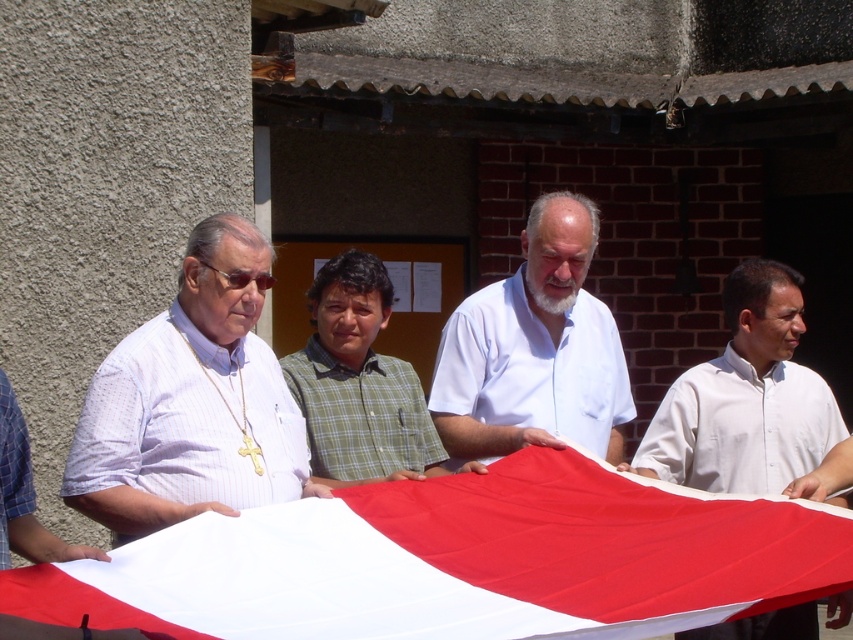
Between white matte shirt at center and white smooth shirt at center, which one has more height?

Standing taller between the two is white matte shirt at center.

Does white matte shirt at center have a greater height compared to white smooth shirt at center?

Correct, white matte shirt at center is much taller as white smooth shirt at center.

The image size is (853, 640). What do you see at coordinates (534, 349) in the screenshot?
I see `white matte shirt at center` at bounding box center [534, 349].

Find the location of `white matte shirt at center`. white matte shirt at center is located at coordinates (534, 349).

Does white fabric flag at center have a lesser width compared to white striped shirt at left?

No, white fabric flag at center is not thinner than white striped shirt at left.

The height and width of the screenshot is (640, 853). What do you see at coordinates (461, 561) in the screenshot? I see `white fabric flag at center` at bounding box center [461, 561].

You are a GUI agent. You are given a task and a screenshot of the screen. Output one action in this format:
    pyautogui.click(x=<x>, y=<y>)
    Task: Click on the white fabric flag at center
    
    Given the screenshot: What is the action you would take?
    pyautogui.click(x=461, y=561)

Who is taller, white fabric flag at center or green checkered shirt at center?

With more height is green checkered shirt at center.

Which is behind, point (784, 561) or point (343, 372)?

Point (343, 372)

At what (x,y) coordinates should I click in order to perform the action: click on white fabric flag at center. Please return your answer as a coordinate pair (x, y). Looking at the image, I should click on (461, 561).